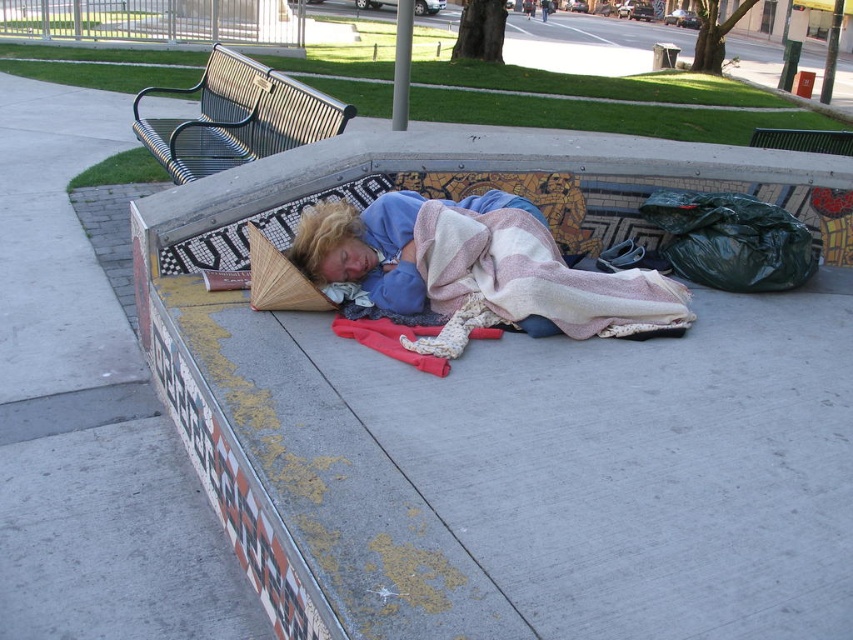
You are standing at the base of the ramp and want to place a heavy object on the bench. Which bench, the concrete bench at center or the black metal bench at upper left, can support more weight?

The concrete bench at center is positioned under the black metal bench at upper left, so the concrete bench at center is likely stronger and can support more weight.

You need to sit down for a short rest. You see a concrete bench at center and a black metal bench at upper left. Which one is bigger and more comfortable for you to sit on?

The concrete bench at center has a larger size compared to the black metal bench at upper left, so it is bigger and more comfortable to sit on.

You are standing at a point 27.19 feet away from the point labeled as point (76, 102). Can you see the red item that could be clothing or a rolled up mat from your current position?

The distance between you and point (76, 102) is 27.19 feet. Since the red item that could be clothing or a rolled up mat is located near the person sleeping on the skateboarding ramp, it should be visible from your current position if there are no obstructions.